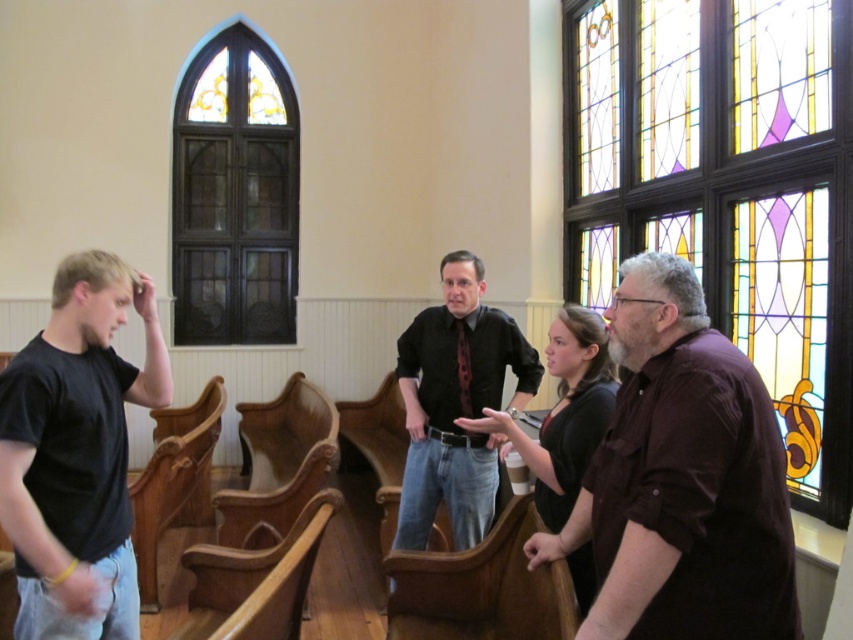
Based on the photo, you are an interior designer assessing the space for a photoshoot. You notice the brown satin shirt at right and the stained glass window at upper left. Which object is shorter in height?

The brown satin shirt at right is not as tall as the stained glass window at upper left, so the brown satin shirt at right is shorter in height.